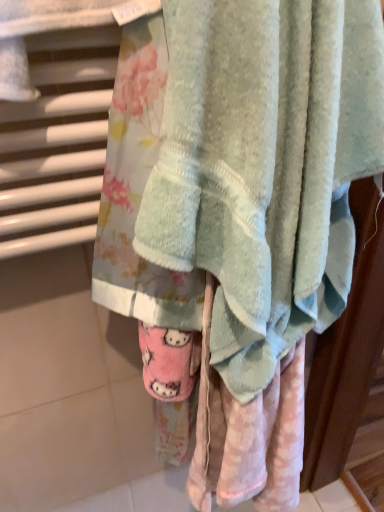
Question: Should I look upward or downward to see soft pastel towel at center?

Choices:
 (A) down
 (B) up

Answer: (B)